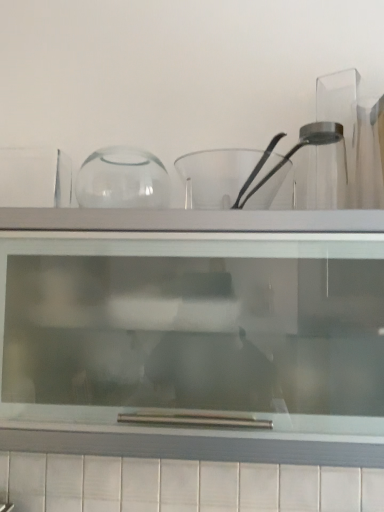
Question: Would you say transparent glass shelf at upper center is inside or outside transparent glass bowl at center?

Choices:
 (A) outside
 (B) inside

Answer: (A)

Question: From the image's perspective, is transparent glass shelf at upper center located above or below transparent glass bowl at center?

Choices:
 (A) below
 (B) above

Answer: (A)

Question: Is transparent glass shelf at upper center in front of or behind transparent glass bowl at center in the image?

Choices:
 (A) behind
 (B) front

Answer: (B)

Question: From a real-world perspective, is transparent glass bowl at center above or below transparent glass shelf at upper center?

Choices:
 (A) above
 (B) below

Answer: (A)

Question: Considering the relative positions of transparent glass bowl at center and transparent glass shelf at upper center in the image provided, is transparent glass bowl at center to the left or to the right of transparent glass shelf at upper center?

Choices:
 (A) left
 (B) right

Answer: (B)

Question: Looking at their shapes, would you say transparent glass bowl at center is wider or thinner than transparent glass shelf at upper center?

Choices:
 (A) wide
 (B) thin

Answer: (B)

Question: From their relative heights in the image, would you say transparent glass bowl at center is taller or shorter than transparent glass shelf at upper center?

Choices:
 (A) tall
 (B) short

Answer: (B)